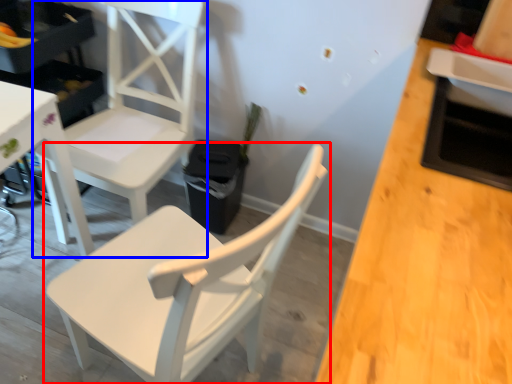
Question: Which object appears closest to the camera in this image, chair (highlighted by a red box) or chair (highlighted by a blue box)?

Choices:
 (A) chair
 (B) chair

Answer: (A)